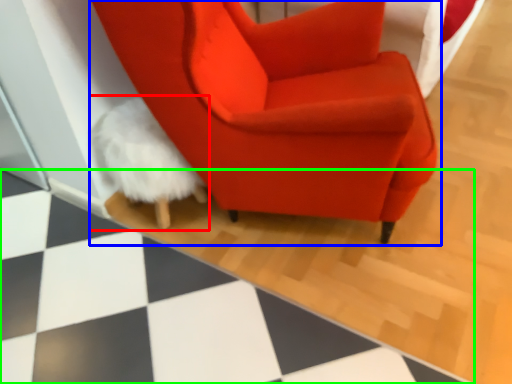
Question: Based on their relative distances, which object is farther from bean bag chair (highlighted by a red box)? Choose from chair (highlighted by a blue box) and tile (highlighted by a green box).

Choices:
 (A) chair
 (B) tile

Answer: (B)